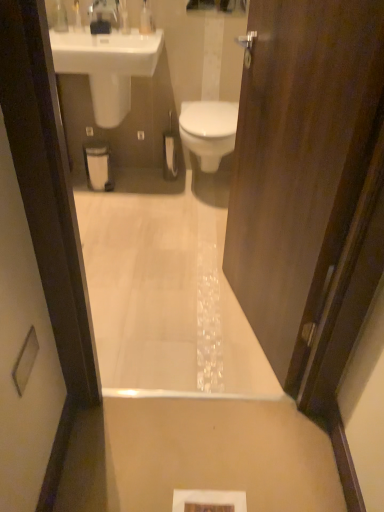
Question: Do you think dark wood door at center is within clear plastic bottle at upper center, arranged as the third toiletry when viewed from the left, or outside of it?

Choices:
 (A) inside
 (B) outside

Answer: (B)

Question: In terms of width, does dark wood door at center look wider or thinner when compared to clear plastic bottle at upper center, arranged as the third toiletry when viewed from the left?

Choices:
 (A) thin
 (B) wide

Answer: (B)

Question: Estimate the real-world distances between objects in this image. Which object is farther from the clear plastic bottle at upper center, arranged as the third toiletry when viewed from the left?

Choices:
 (A) translucent plastic soap dispenser at upper center, arranged as the second toiletry when viewed from the right
 (B) glossy glass mirror at upper center
 (C) white glossy sink at upper left
 (D) white glossy bath at center
 (E) clear plastic bottle at upper left, placed as the 1th toiletry when sorted from left to right

Answer: (D)

Question: Estimate the real-world distances between objects in this image. Which object is closer to the white glossy bath at center?

Choices:
 (A) glossy glass mirror at upper center
 (B) clear plastic bottle at upper center, arranged as the third toiletry when viewed from the left
 (C) satin nickel faucet at upper center
 (D) clear plastic bottle at upper left, which appears as the third toiletry when viewed from the right
 (E) white glossy bidet at center

Answer: (E)